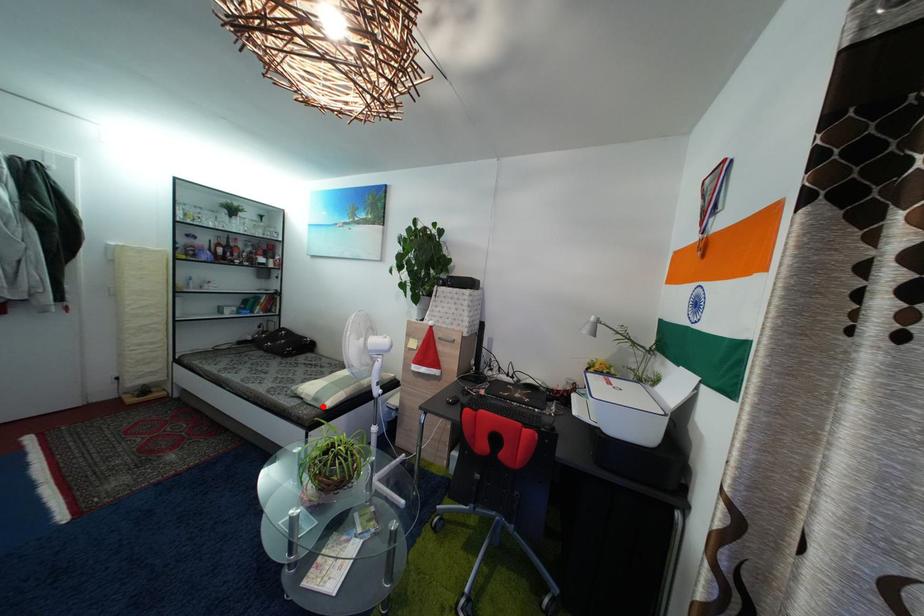
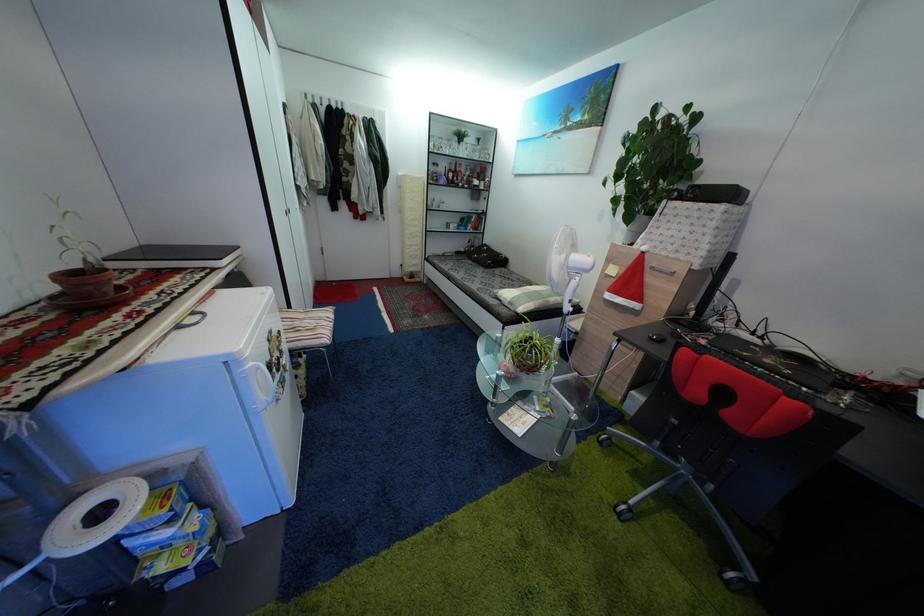
Find the pixel in the second image that matches the highlighted location in the first image.

(517, 310)